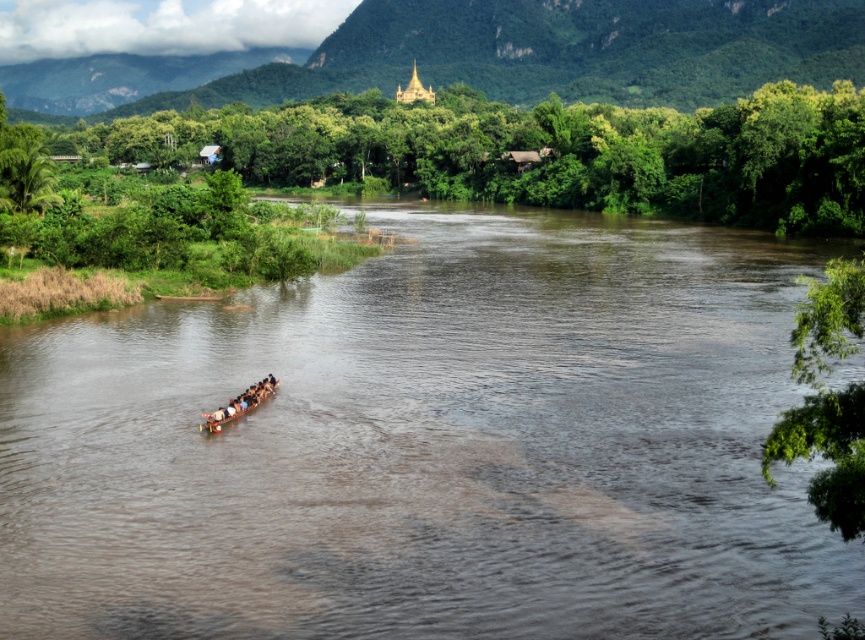
Question: Which object appears closest to the camera in this image?

Choices:
 (A) wooden paddle at center
 (B) brown wooden canoe at center
 (C) brown matte water at center

Answer: (C)

Question: Is brown matte water at center bigger than brown wooden canoe at center?

Choices:
 (A) no
 (B) yes

Answer: (B)

Question: Is brown wooden canoe at center thinner than wooden paddle at center?

Choices:
 (A) no
 (B) yes

Answer: (B)

Question: Among these objects, which one is nearest to the camera?

Choices:
 (A) brown matte water at center
 (B) brown wooden canoe at center

Answer: (A)

Question: Is brown matte water at center bigger than brown wooden canoe at center?

Choices:
 (A) no
 (B) yes

Answer: (B)

Question: Which point appears farthest from the camera in this image?

Choices:
 (A) (853, 586)
 (B) (216, 429)

Answer: (B)